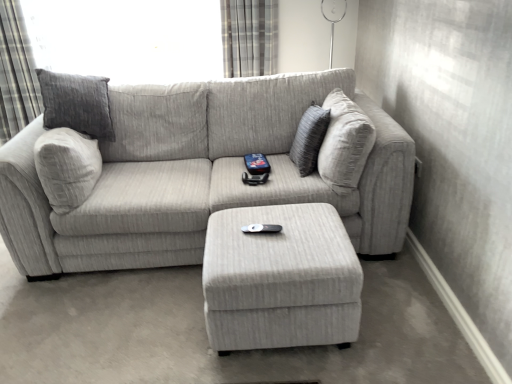
At what (x,y) coordinates should I click in order to perform the action: click on vacant space that is to the left of black plastic remote at center. Please return your answer as a coordinate pair (x, y). Looking at the image, I should click on (228, 233).